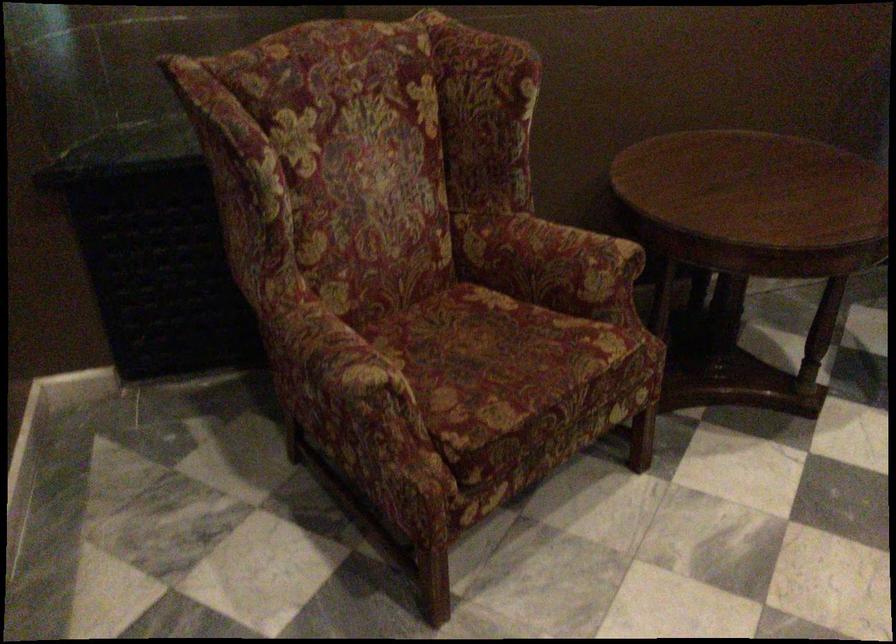
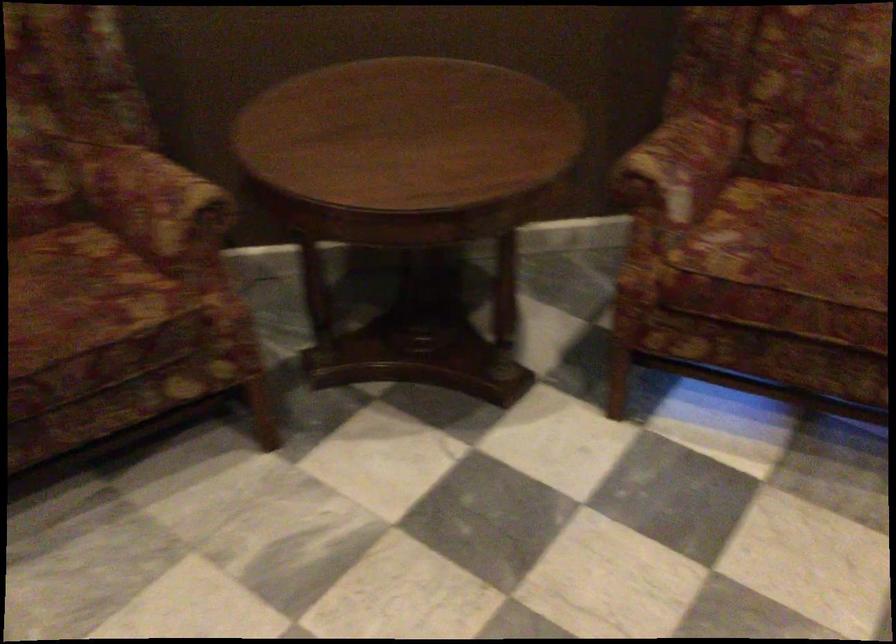
Where in the second image is the point corresponding to (x=575, y=257) from the first image?

(156, 204)